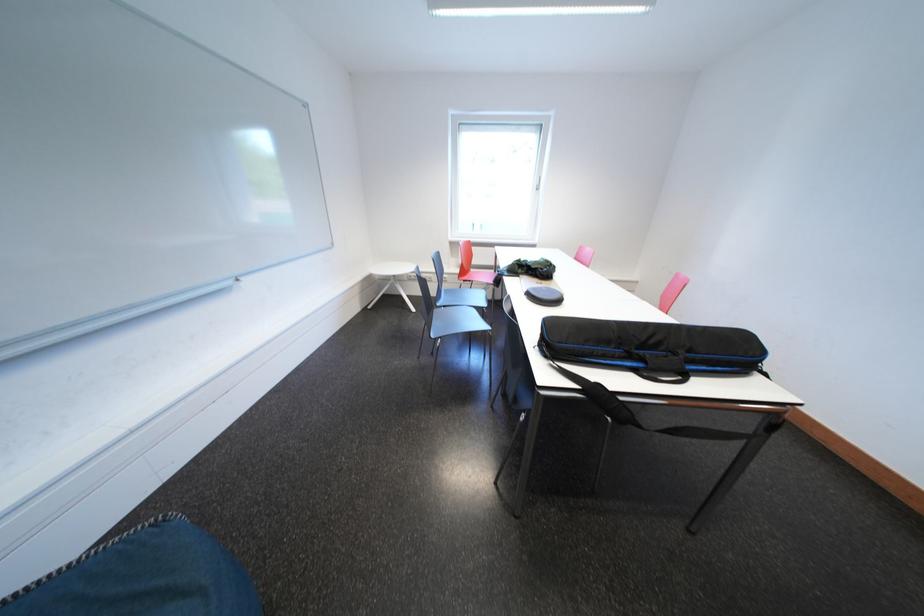
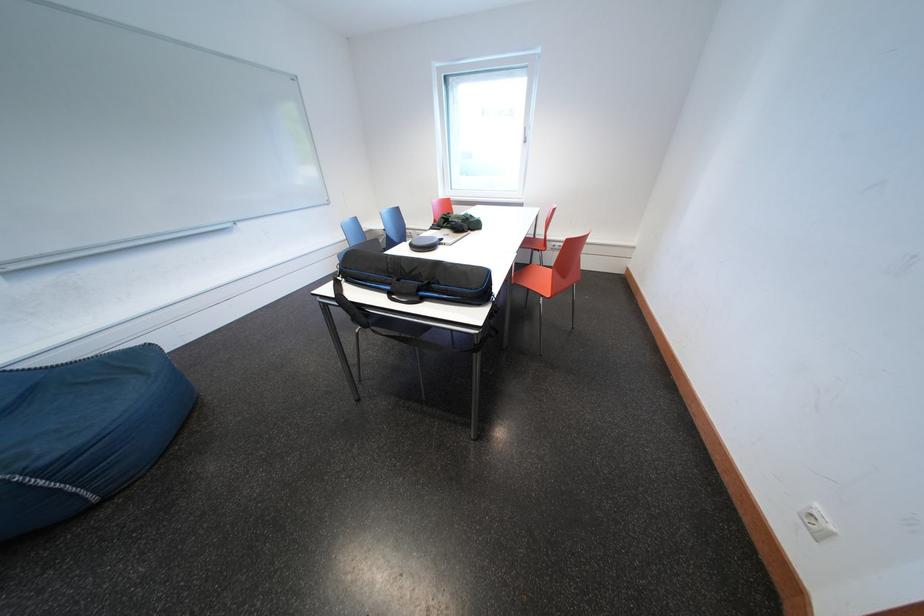
Question: Which direction would the cameraman need to move to produce the second image? Reply with the corresponding letter.

Choices:
 (A) Left
 (B) Right
 (C) Forward
 (D) Backward

Answer: (B)